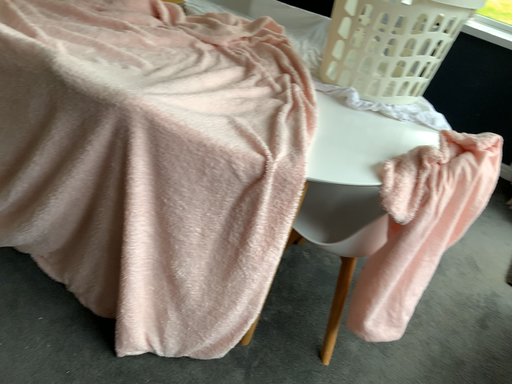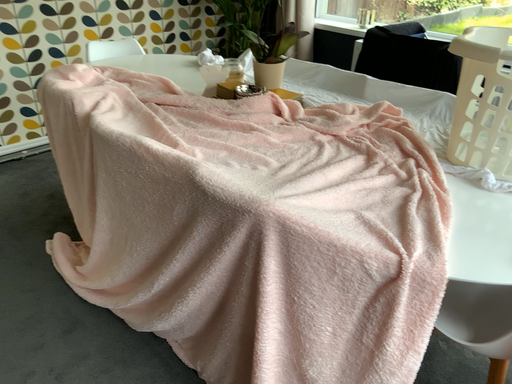
Question: Which way did the camera rotate in the video?

Choices:
 (A) rotated upward
 (B) rotated downward

Answer: (A)